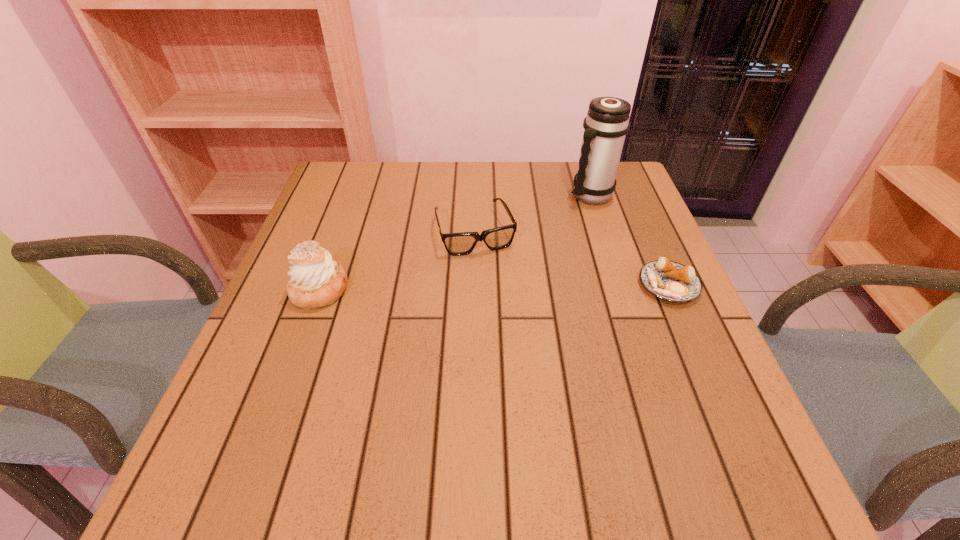
Locate an element on the screen. free space between the second shortest object and the farthest object is located at coordinates (533, 213).

Locate an element on the screen. This screenshot has width=960, height=540. free spot between the sunglasses and the leftmost object is located at coordinates (397, 260).

At what (x,y) coordinates should I click in order to perform the action: click on blank region between the left pastry and the third tallest object. Please return your answer as a coordinate pair (x, y). Looking at the image, I should click on (397, 260).

At what (x,y) coordinates should I click in order to perform the action: click on free space between the third nearest object and the farthest object. Please return your answer as a coordinate pair (x, y). Looking at the image, I should click on (533, 213).

At what (x,y) coordinates should I click in order to perform the action: click on free space between the shortest object and the tallest object. Please return your answer as a coordinate pair (x, y). The width and height of the screenshot is (960, 540). Looking at the image, I should click on (630, 240).

Locate which object ranks in proximity to the leftmost object. Please provide its 2D coordinates. Your answer should be formatted as a tuple, i.e. [(x, y)], where the tuple contains the x and y coordinates of a point satisfying the conditions above.

[(456, 244)]

The height and width of the screenshot is (540, 960). Find the location of `object that stands as the third closest to the farthest object`. object that stands as the third closest to the farthest object is located at coordinates (316, 280).

Find the location of a particular element. free location that satisfies the following two spatial constraints: 1. on the back side of the sunglasses; 2. on the right side of the third shortest object is located at coordinates (341, 231).